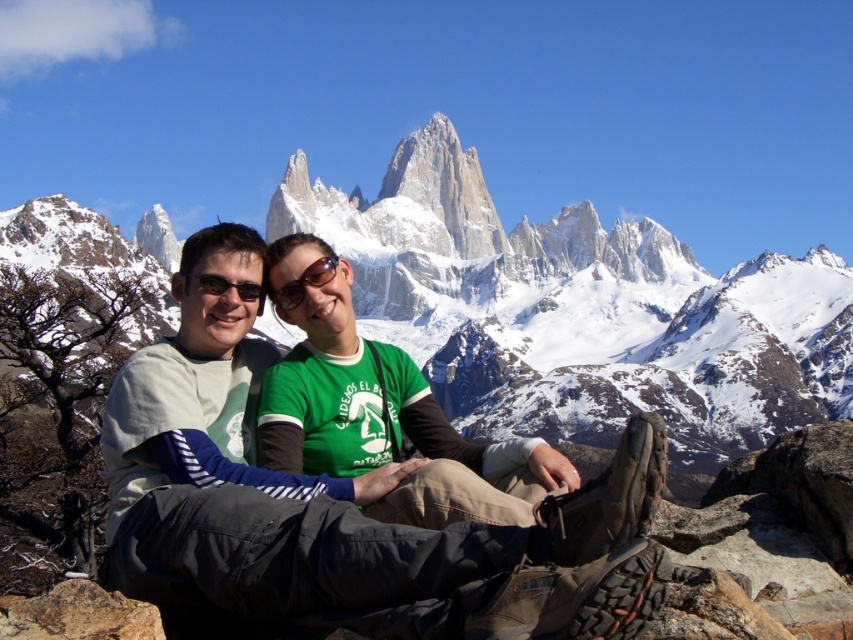
You are a photographer planning to take a photo of the snowy granite mountain range at upper center and the light gray fabric pants at center. Based on their positions, which object will appear closer to the camera in the photo?

The light gray fabric pants at center will appear closer to the camera in the photo because the snowy granite mountain range at upper center is further away from the viewer.

You are planning to take a photo of the snowy granite mountain range at upper center while standing near the black plastic sunglasses at center. Considering the distance between them, would you need a telephoto lens to capture the entire mountain range in your shot?

The distance between the snowy granite mountain range at upper center and the black plastic sunglasses at center is 460.63 feet. To capture the entire mountain range from this distance, a telephoto lens would be necessary to compress the scene and ensure the mountains fill the frame appropriately.